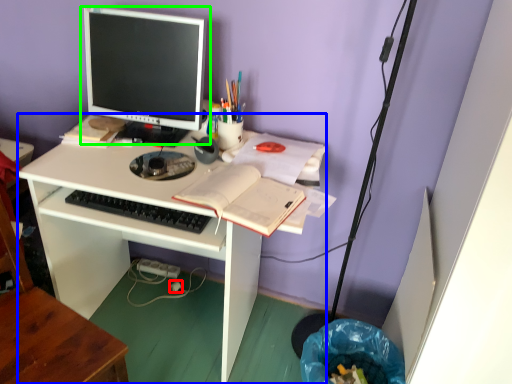
Question: Based on their relative distances, which object is nearer to power plugs and sockets (highlighted by a red box)? Choose from desk (highlighted by a blue box) and computer monitor (highlighted by a green box).

Choices:
 (A) desk
 (B) computer monitor

Answer: (A)